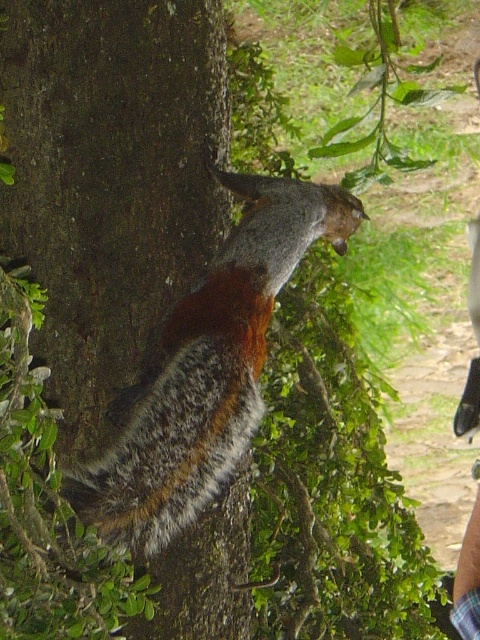
You are a nature photographer trying to capture the squirrel in the image. The squirrel is on a tree trunk with brown rough bark at center and fuzzy brown fur at center. Which object is taller in the scene?

The brown rough bark at center is much taller than the fuzzy brown fur at center.

You are a nature photographer trying to capture the texture of the brown rough bark at center and the fuzzy brown fur at center of the squirrel. Which of the two has a smaller surface area visible in the image?

The brown rough bark at center has a smaller size compared to the fuzzy brown fur at center, so the brown rough bark at center has a smaller surface area visible in the image.